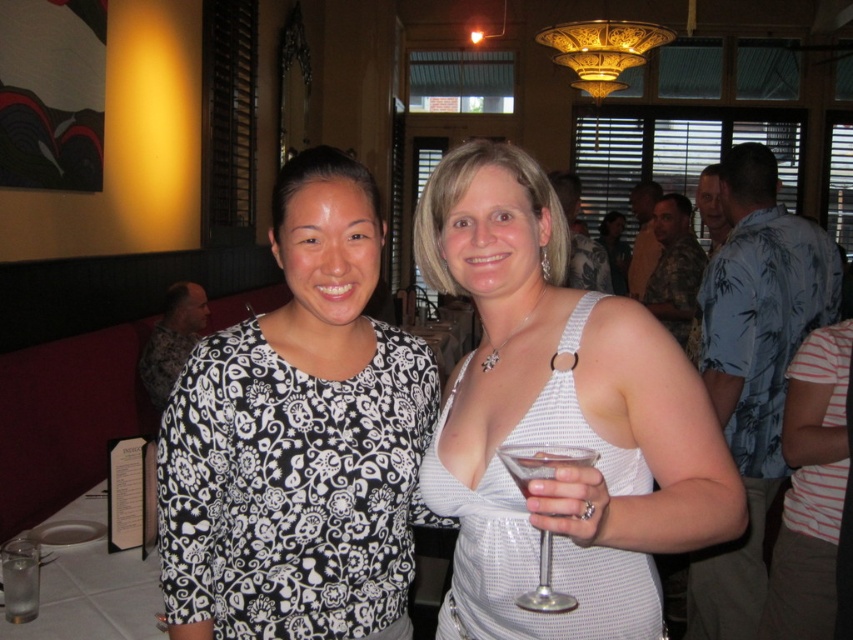
Question: Is white textured dress at center smaller than clear glass martini glass at center?

Choices:
 (A) no
 (B) yes

Answer: (A)

Question: Estimate the real-world distances between objects in this image. Which object is farther from the white textured dress at center?

Choices:
 (A) black printed blouse at center
 (B) clear glass at lower left

Answer: (B)

Question: Which of the following is the farthest from the observer?

Choices:
 (A) black printed blouse at center
 (B) white textured dress at center
 (C) clear glass martini glass at center
 (D) clear glass at lower left

Answer: (D)

Question: From the image, what is the correct spatial relationship of black printed blouse at center in relation to clear glass at lower left?

Choices:
 (A) left
 (B) right

Answer: (B)

Question: Which object is closer to the camera taking this photo?

Choices:
 (A) black printed blouse at center
 (B) clear glass at lower left
 (C) white textured dress at center
 (D) clear glass martini glass at center

Answer: (D)

Question: Is white textured dress at center above clear glass martini glass at center?

Choices:
 (A) yes
 (B) no

Answer: (A)